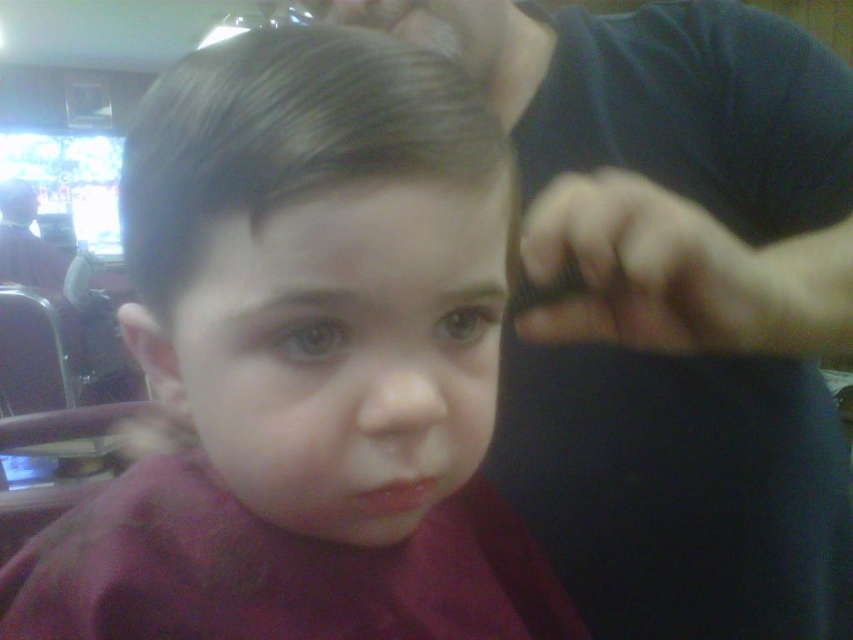
Does matte black hair at center appear over dark blue shirt at upper right?

Incorrect, matte black hair at center is not positioned above dark blue shirt at upper right.

Can you confirm if matte black hair at center is positioned to the left of dark blue shirt at upper right?

Correct, you'll find matte black hair at center to the left of dark blue shirt at upper right.

Is point (198, 637) positioned behind point (544, 276)?

No, (198, 637) is closer to viewer.

In order to click on matte black hair at center in this screenshot , I will do `click(305, 364)`.